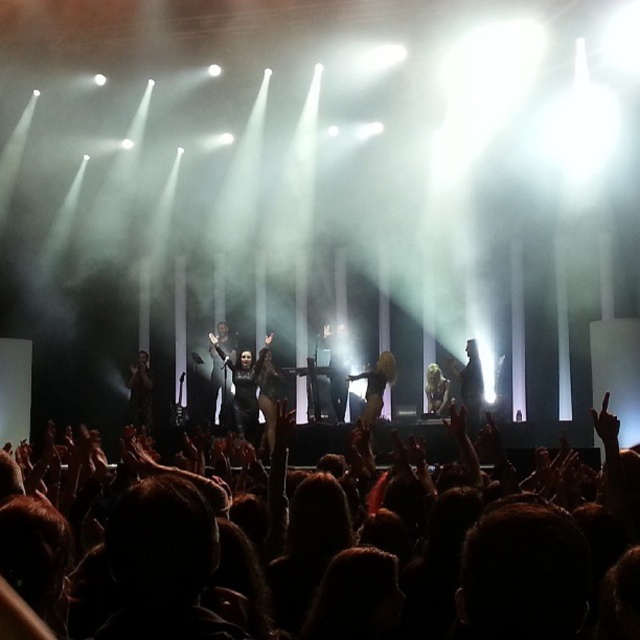
You are a photographer trying to capture the best angle for a closeup shot of the performer. You notice two points on the stage marked as point 1 and point 2. Point 1 is at coordinate (212, 342) and point 2 is at (365, 397). Based on their positions, which point is closer to your camera lens?

Point 1 at coordinate (212, 342) is closer to the camera lens than point 2 at (365, 397) because it is further to the camera according to their spatial relationship.